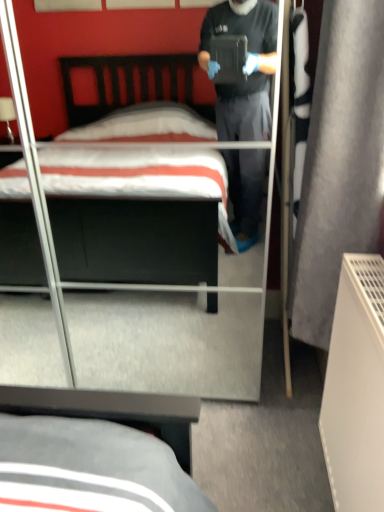
Question: Can we say matte black bed at center lies outside gray fabric curtain at right?

Choices:
 (A) no
 (B) yes

Answer: (B)

Question: Can you confirm if matte black bed at center is smaller than gray fabric curtain at right?

Choices:
 (A) yes
 (B) no

Answer: (B)

Question: From a real-world perspective, is matte black bed at center below gray fabric curtain at right?

Choices:
 (A) no
 (B) yes

Answer: (B)

Question: Can you confirm if matte black bed at center is wider than gray fabric curtain at right?

Choices:
 (A) yes
 (B) no

Answer: (A)

Question: Is matte black bed at center closer to camera compared to gray fabric curtain at right?

Choices:
 (A) yes
 (B) no

Answer: (B)

Question: Considering the relative sizes of matte black bed at center and gray fabric curtain at right in the image provided, is matte black bed at center shorter than gray fabric curtain at right?

Choices:
 (A) yes
 (B) no

Answer: (B)

Question: Considering the relative positions of gray fabric curtain at right and matte black bed at center in the image provided, is gray fabric curtain at right behind matte black bed at center?

Choices:
 (A) yes
 (B) no

Answer: (B)

Question: Is the depth of gray fabric curtain at right less than that of matte black bed at center?

Choices:
 (A) no
 (B) yes

Answer: (B)

Question: Is gray fabric curtain at right touching matte black bed at center?

Choices:
 (A) yes
 (B) no

Answer: (B)

Question: Can you confirm if gray fabric curtain at right is positioned to the left of matte black bed at center?

Choices:
 (A) yes
 (B) no

Answer: (B)

Question: Is gray fabric curtain at right not within matte black bed at center?

Choices:
 (A) yes
 (B) no

Answer: (A)

Question: Is gray fabric curtain at right facing towards matte black bed at center?

Choices:
 (A) no
 (B) yes

Answer: (B)

Question: In terms of width, does matte black bed at center look wider or thinner when compared to gray fabric curtain at right?

Choices:
 (A) thin
 (B) wide

Answer: (B)